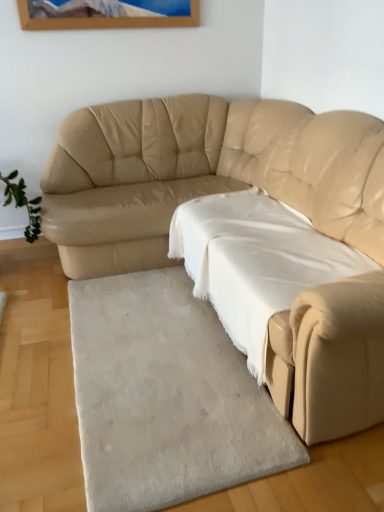
Question: Is white cotton sheet at center aimed at beige leather couch at center?

Choices:
 (A) no
 (B) yes

Answer: (B)

Question: Is white cotton sheet at center not close to beige leather couch at center?

Choices:
 (A) yes
 (B) no

Answer: (B)

Question: Considering the relative positions of white cotton sheet at center and beige leather couch at center in the image provided, is white cotton sheet at center to the left of beige leather couch at center from the viewer's perspective?

Choices:
 (A) yes
 (B) no

Answer: (B)

Question: Considering the relative sizes of white cotton sheet at center and beige leather couch at center in the image provided, is white cotton sheet at center wider than beige leather couch at center?

Choices:
 (A) no
 (B) yes

Answer: (A)

Question: Is the position of white cotton sheet at center less distant than that of beige leather couch at center?

Choices:
 (A) no
 (B) yes

Answer: (A)

Question: In terms of height, does white cotton sheet at center look taller or shorter compared to beige leather couch at center?

Choices:
 (A) short
 (B) tall

Answer: (A)

Question: Visually, is white cotton sheet at center positioned to the left or to the right of beige leather couch at center?

Choices:
 (A) left
 (B) right

Answer: (B)

Question: From the image's perspective, is white cotton sheet at center above or below beige leather couch at center?

Choices:
 (A) below
 (B) above

Answer: (A)

Question: Considering the positions of white cotton sheet at center and beige leather couch at center in the image, is white cotton sheet at center bigger or smaller than beige leather couch at center?

Choices:
 (A) big
 (B) small

Answer: (B)

Question: Which is correct: white soft rug at lower center is inside beige leather couch at center, or outside of it?

Choices:
 (A) inside
 (B) outside

Answer: (A)

Question: From a real-world perspective, is white soft rug at lower center above or below beige leather couch at center?

Choices:
 (A) above
 (B) below

Answer: (B)

Question: Would you say white soft rug at lower center is to the left or to the right of beige leather couch at center in the picture?

Choices:
 (A) right
 (B) left

Answer: (B)

Question: Is point (264, 461) closer or farther from the camera than point (296, 162)?

Choices:
 (A) farther
 (B) closer

Answer: (B)

Question: Considering their positions, is white cotton sheet at center located in front of or behind white soft rug at lower center?

Choices:
 (A) behind
 (B) front

Answer: (A)

Question: From the image's perspective, is white cotton sheet at center positioned above or below white soft rug at lower center?

Choices:
 (A) below
 (B) above

Answer: (B)